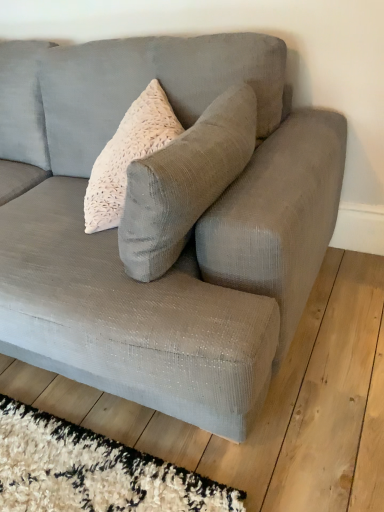
What do you see at coordinates (173, 231) in the screenshot?
I see `textured gray couch at center` at bounding box center [173, 231].

I want to click on textured gray couch at center, so click(173, 231).

Image resolution: width=384 pixels, height=512 pixels. Find the location of `textured gray couch at center`. textured gray couch at center is located at coordinates (173, 231).